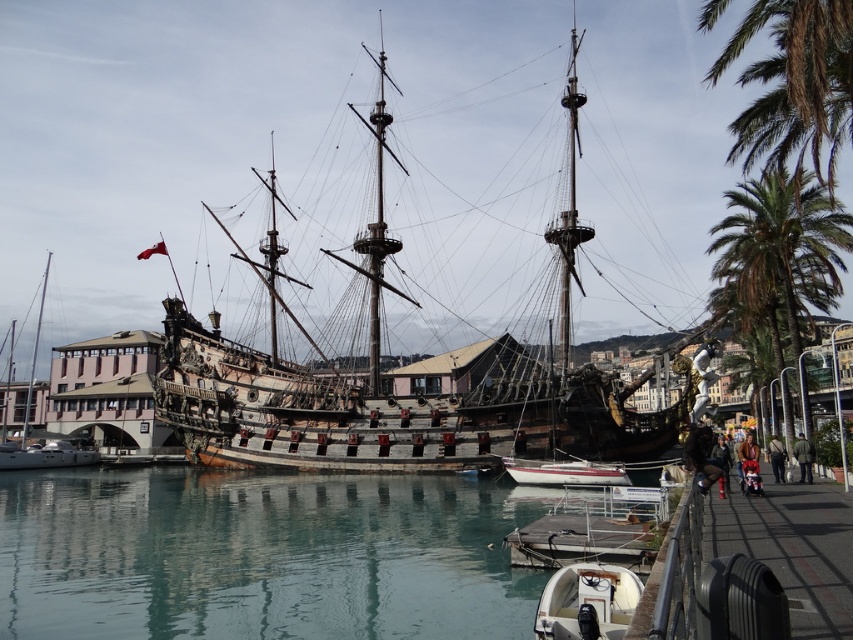
You are standing on the dock and see the white glossy boat at lower center and the smooth wood mast at left. Which object is located to the right of the other?

The white glossy boat at lower center is positioned on the right side of smooth wood mast at left.

You are a sailor on the white glossy boat at lower center and want to check the water below. Is the clear water at center visible from your current position?

The clear water at center is located below the white glossy boat at lower center, so yes, the sailor can see the clear water at center from their position on the boat.

You are standing on the deck of the ship and looking out. There is a point marked at coordinates (262, 556). Based on the scene description, what do you see at that location?

The point at coordinates (262, 556) indicates clear water at center.